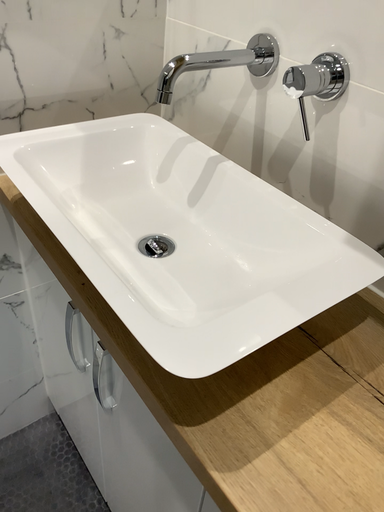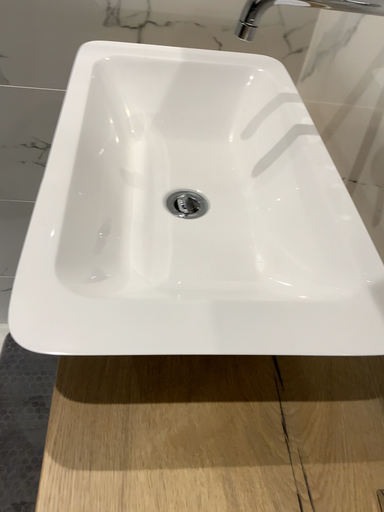
Question: How did the camera likely rotate when shooting the video?

Choices:
 (A) rotated right
 (B) rotated left

Answer: (B)